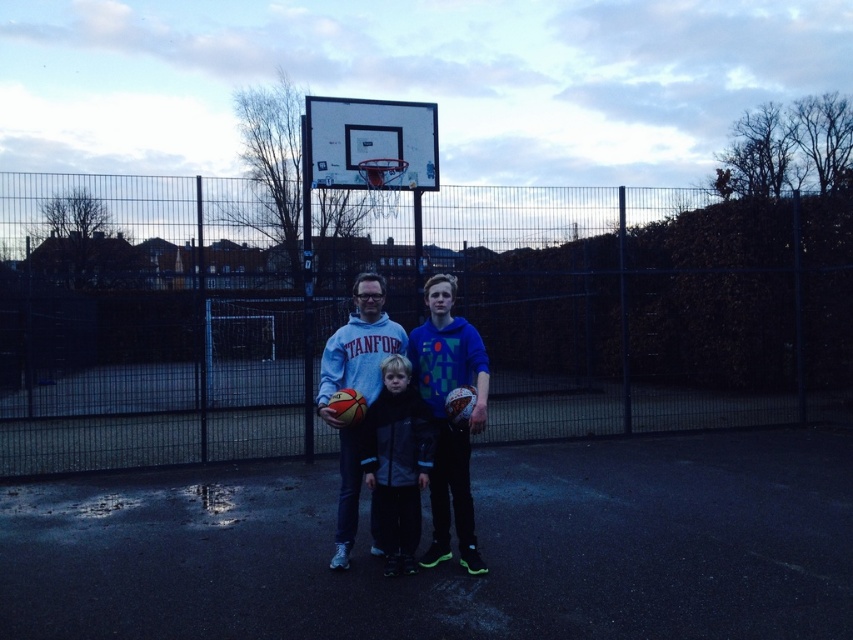
You are a photographer trying to capture a photo of the two people wearing the blue matte hoodie at center and dark gray fleece jacket at center. Since they are standing close together, you want to ensure you frame them properly. Which one is positioned to the right side of the other?

The blue matte hoodie at center is to the right of dark gray fleece jacket at center.

You are a photographer trying to capture a group photo of the blue matte hoodie at center and the dark gray fleece jacket at center. If you want to ensure both subjects are fully visible in the frame, which subject should you position closer to the camera to avoid cropping?

The blue matte hoodie at center is wider than the dark gray fleece jacket at center. To ensure both are fully visible, position the wider blue matte hoodie at center closer to the camera so its greater width can fit within the frame without being cropped.

You are taking a photo of the three people in the scene. You want to focus on the person at point (416,509) and the person at point (331,362). Which of these two points should you adjust your camera focus to first if you want to ensure both are in focus?

You should focus on the point that is closer to the camera first. Since point (416,509) is closer than point (331,362), you should adjust your camera focus to point (416,509) first to ensure both are in focus.